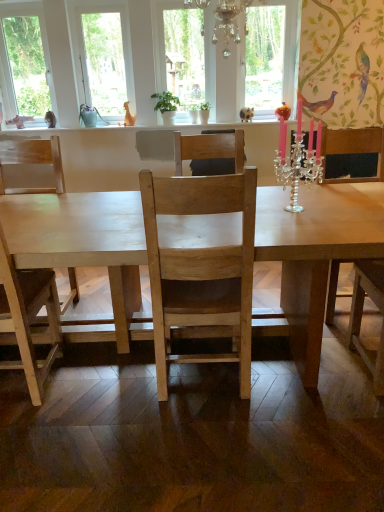
Find the location of a particular element. free space to the left of silver/crystal candle holder at upper right is located at coordinates (263, 213).